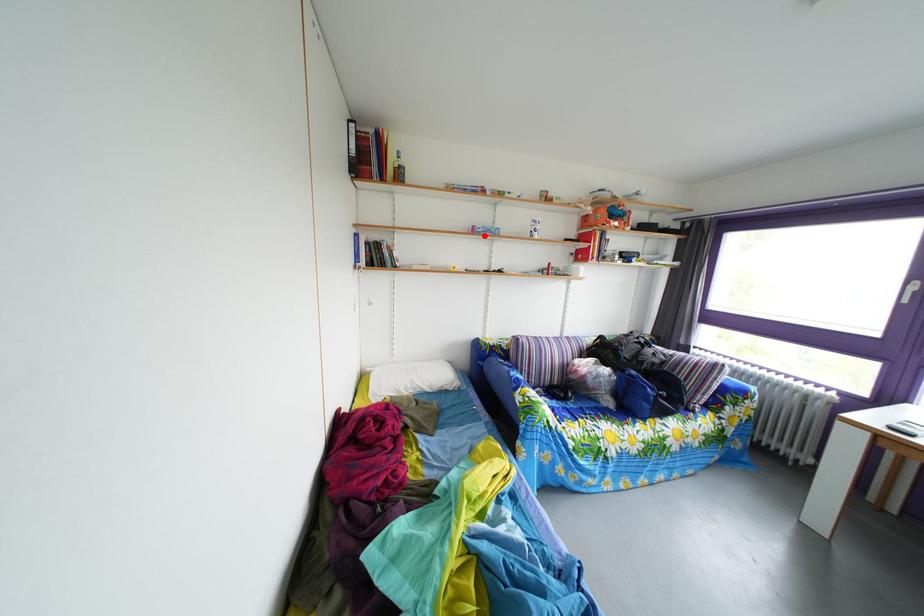
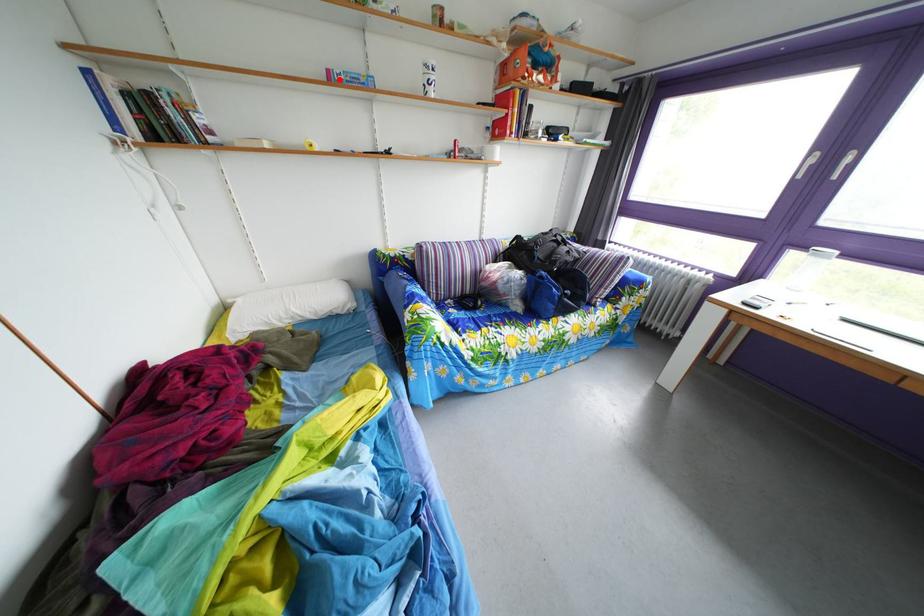
I am providing you with two images of the same scene from different viewpoints. A red point is marked on the first image and another point is marked on the second image. Do the highlighted points in image1 and image2 indicate the same real-world spot?

Yes